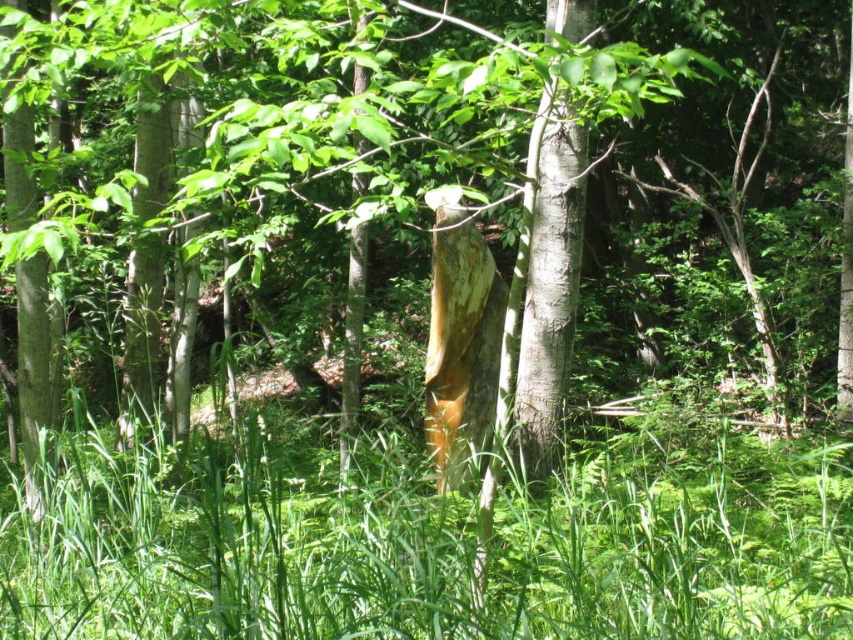
Question: Which point is farther from the camera taking this photo?

Choices:
 (A) pyautogui.click(x=122, y=605)
 (B) pyautogui.click(x=529, y=285)

Answer: (B)

Question: Is green grass at center bigger than smooth white tree trunk at center?

Choices:
 (A) yes
 (B) no

Answer: (A)

Question: Considering the relative positions of green grass at center and smooth white tree trunk at center in the image provided, where is green grass at center located with respect to smooth white tree trunk at center?

Choices:
 (A) above
 (B) below

Answer: (B)

Question: Where is green grass at center located in relation to smooth white tree trunk at center in the image?

Choices:
 (A) left
 (B) right

Answer: (A)

Question: Which point is closer to the camera?

Choices:
 (A) (550, 410)
 (B) (50, 508)

Answer: (B)